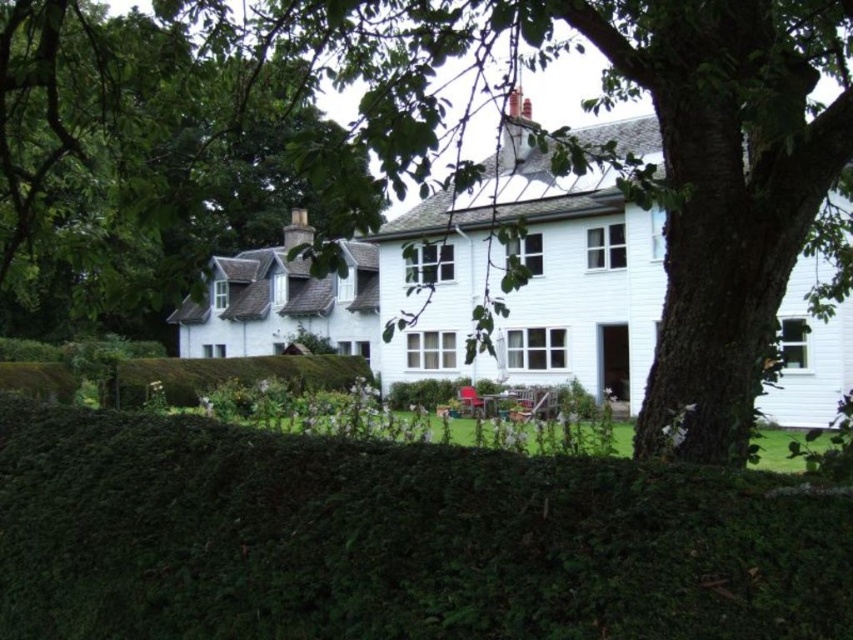
You are standing in the garden area and want to walk towards the house. Which object, the green leafy hedge at lower center or the green leafy tree at center, should you pass by first?

You should pass by the green leafy hedge at lower center first because it is located to the left of the green leafy tree at center, so when approaching the house from the garden area, you would encounter the hedge before reaching the tree.

You are standing in the garden area and want to place a new flower pot between the green leafy hedge at lower center and the green leafy tree at center. Based on their positions, which object should the flower pot be closer to?

The green leafy hedge at lower center is positioned under the green leafy tree at center, so the flower pot should be placed closer to the green leafy hedge at lower center since it is directly beneath the tree.